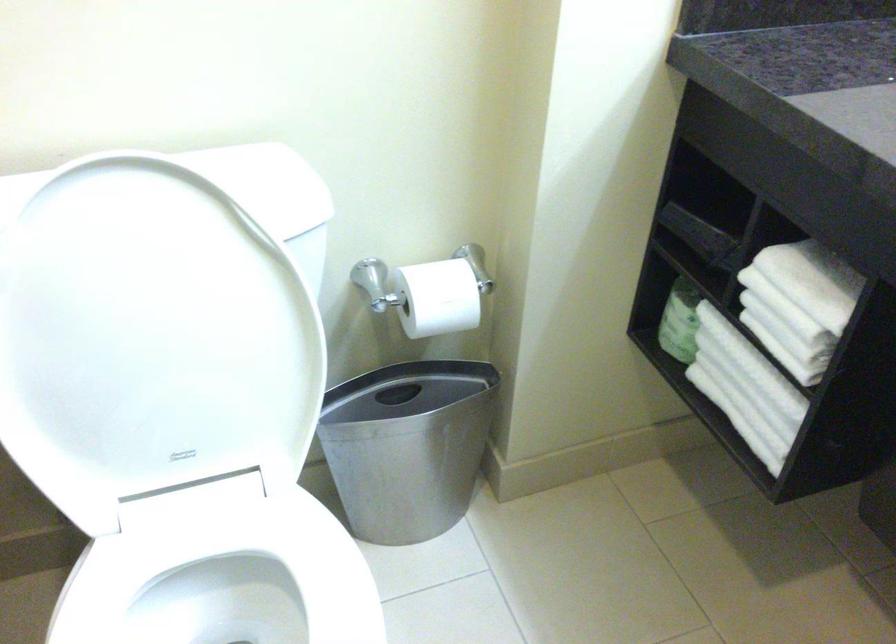
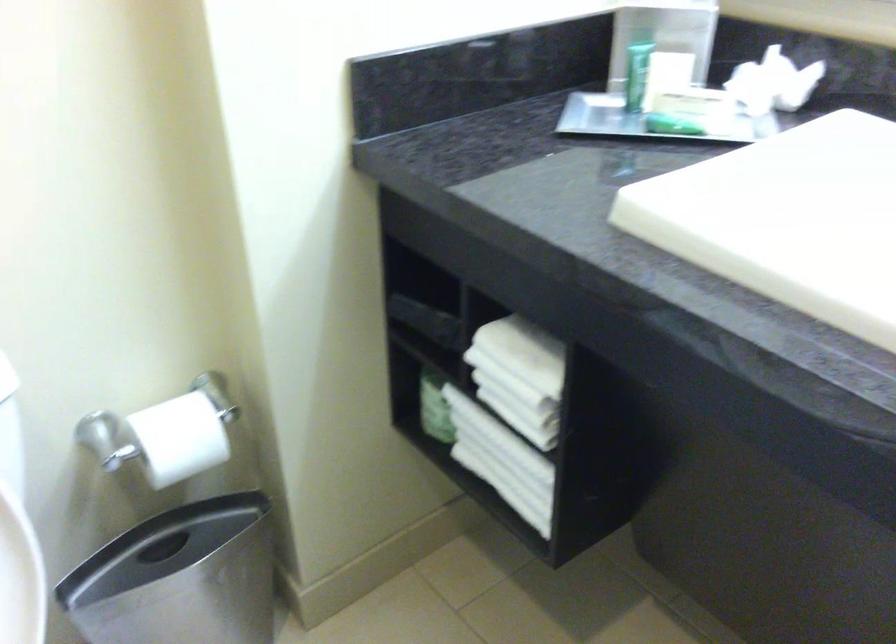
Question: The first image is from the beginning of the video and the second image is from the end. How did the camera likely rotate when shooting the video?

Choices:
 (A) Left
 (B) Right
 (C) Up
 (D) Down

Answer: (B)